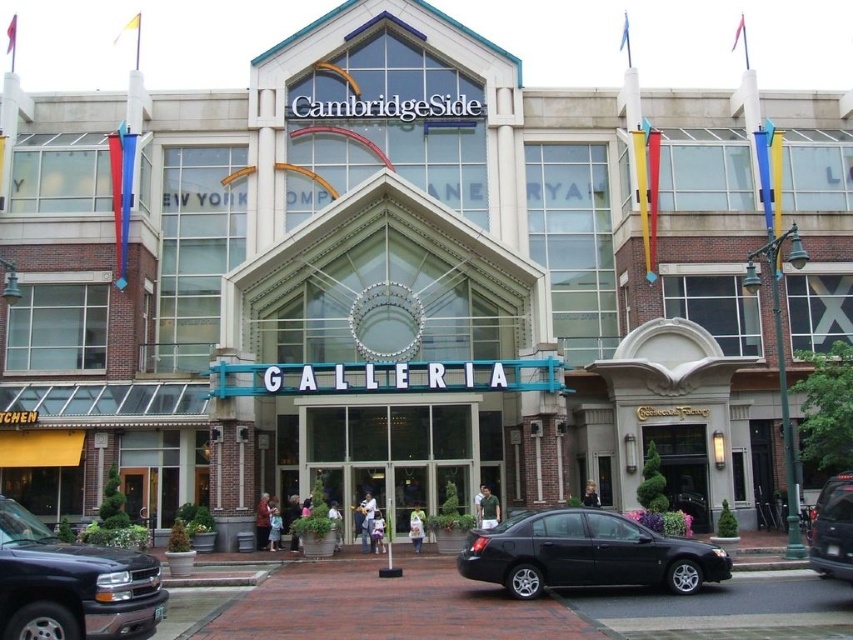
Question: Does black matte sedan at center come in front of black wooden door at center?

Choices:
 (A) yes
 (B) no

Answer: (A)

Question: Does black matte sedan at center lie behind black wooden door at center?

Choices:
 (A) no
 (B) yes

Answer: (A)

Question: Which point appears closest to the camera in this image?

Choices:
 (A) (840, 541)
 (B) (566, 582)
 (C) (689, 513)
 (D) (126, 566)

Answer: (D)

Question: Is black matte sedan at center closer to the viewer compared to metallic gray suv at center?

Choices:
 (A) no
 (B) yes

Answer: (A)

Question: Which point appears closest to the camera in this image?

Choices:
 (A) (830, 554)
 (B) (157, 621)
 (C) (664, 572)

Answer: (B)

Question: Which point is farther from the camera taking this photo?

Choices:
 (A) (822, 500)
 (B) (689, 449)
 (C) (68, 548)

Answer: (B)